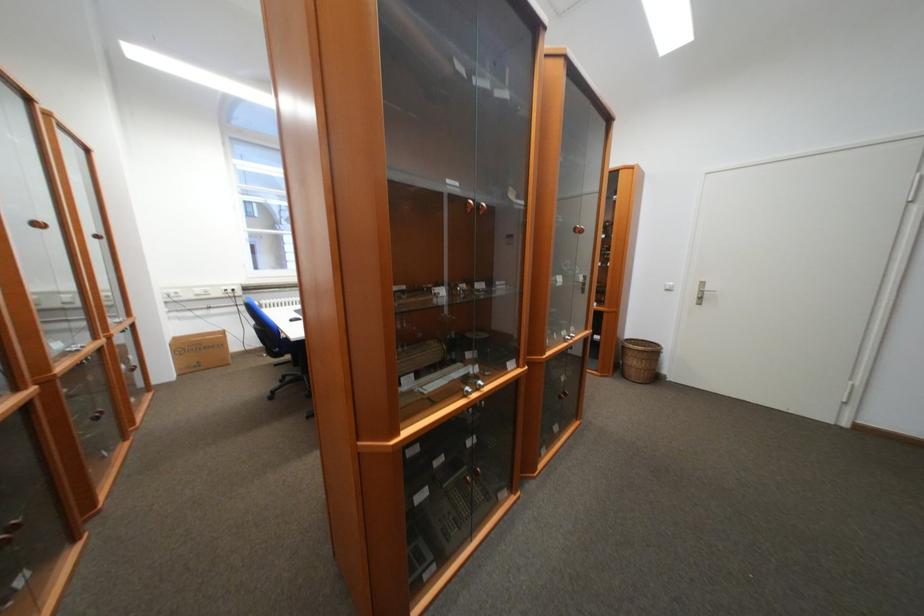
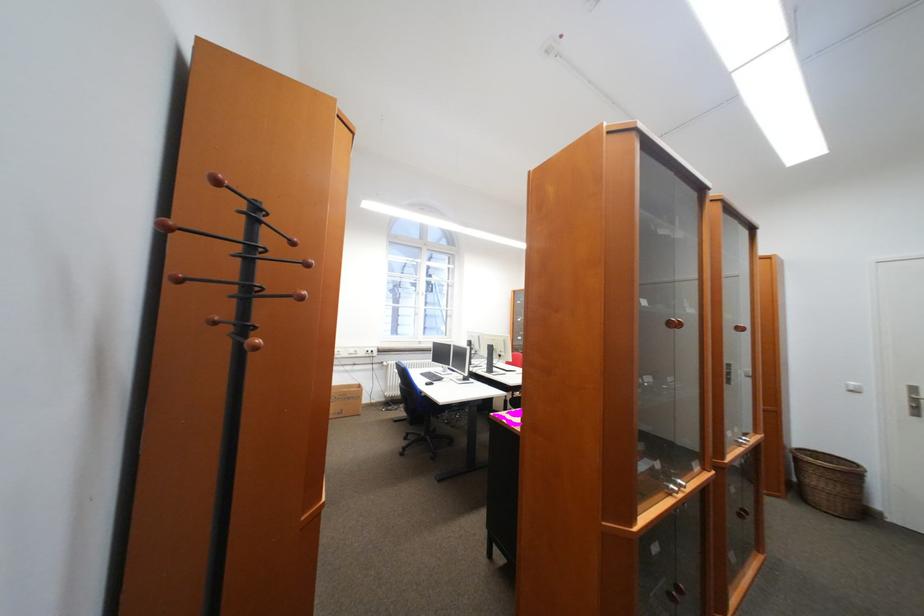
Find the pixel in the second image that matches point (204, 368) in the first image.

(347, 415)